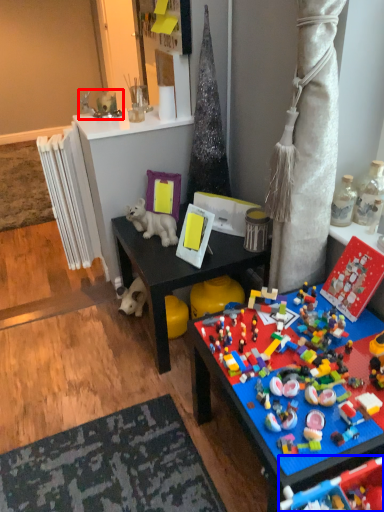
Question: Which object appears farthest to the camera in this image, toy (highlighted by a red box) or toy (highlighted by a blue box)?

Choices:
 (A) toy
 (B) toy

Answer: (A)